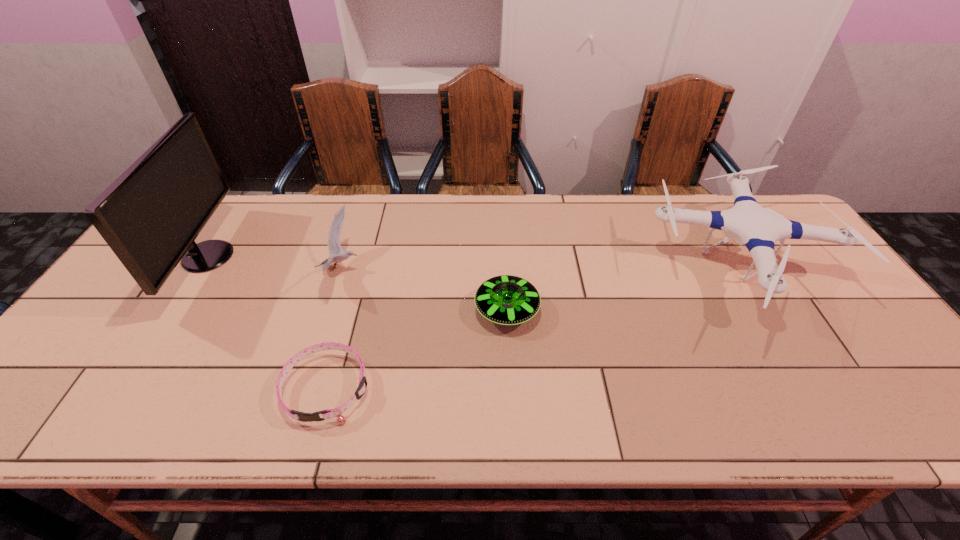
You are a GUI agent. You are given a task and a screenshot of the screen. Output one action in this format:
    pyautogui.click(x=<x>, y=<y>)
    Task: Click on the empty space between the computer monitor and the dog collar
    This screenshot has width=960, height=540.
    Given the screenshot: What is the action you would take?
    coord(268,322)

Where is `free point between the fourth shortest object and the third tallest object`? Image resolution: width=960 pixels, height=540 pixels. free point between the fourth shortest object and the third tallest object is located at coordinates (540, 269).

You are a GUI agent. You are given a task and a screenshot of the screen. Output one action in this format:
    pyautogui.click(x=<x>, y=<y>)
    Task: Click on the empty space that is in between the gull and the rightmost object
    The image size is (960, 540).
    Given the screenshot: What is the action you would take?
    pyautogui.click(x=540, y=269)

What are the coordinates of `vacant area that lies between the shortest object and the third shortest object` in the screenshot? It's located at (334, 328).

Identify the location of vacant region between the leftmost object and the gull. Image resolution: width=960 pixels, height=540 pixels. (275, 263).

Point out which object is positioned as the fourth nearest to the nearest object. Please provide its 2D coordinates. Your answer should be formatted as a tuple, i.e. [(x, y)], where the tuple contains the x and y coordinates of a point satisfying the conditions above.

[(748, 223)]

Identify which object is the nearest to the gull. Please provide its 2D coordinates. Your answer should be formatted as a tuple, i.e. [(x, y)], where the tuple contains the x and y coordinates of a point satisfying the conditions above.

[(337, 412)]

Image resolution: width=960 pixels, height=540 pixels. I want to click on vacant space that satisfies the following two spatial constraints: 1. on the front-facing side of the tallest object; 2. on the back side of the rightmost object, so click(201, 269).

What are the coordinates of `blank area in the image that satisfies the following two spatial constraints: 1. on the front-facing side of the computer monitor; 2. on the left side of the saucer` in the screenshot? It's located at (174, 310).

At what (x,y) coordinates should I click in order to perform the action: click on free spot that satisfies the following two spatial constraints: 1. on the front-facing side of the leftmost object; 2. on the left side of the second tallest object. Please return your answer as a coordinate pair (x, y). Looking at the image, I should click on (201, 269).